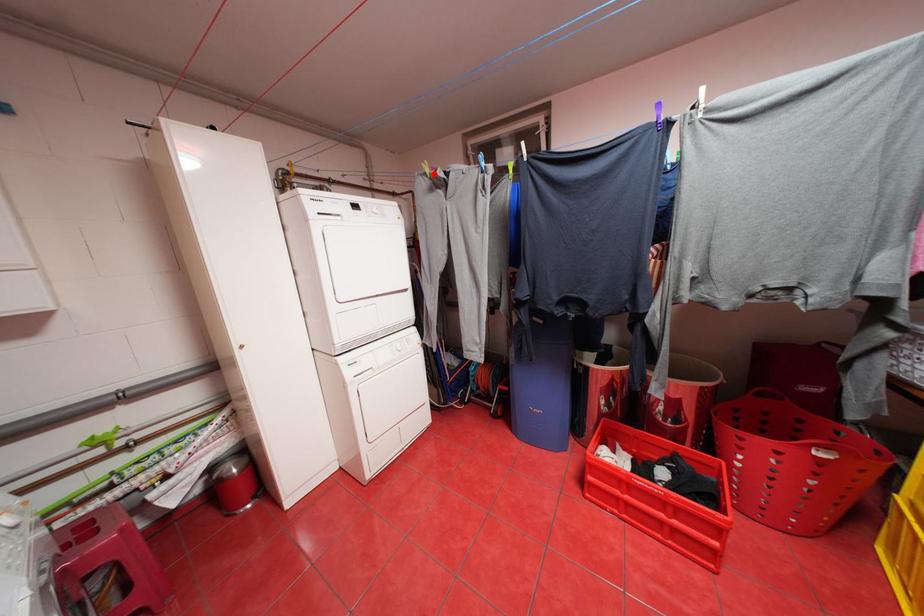
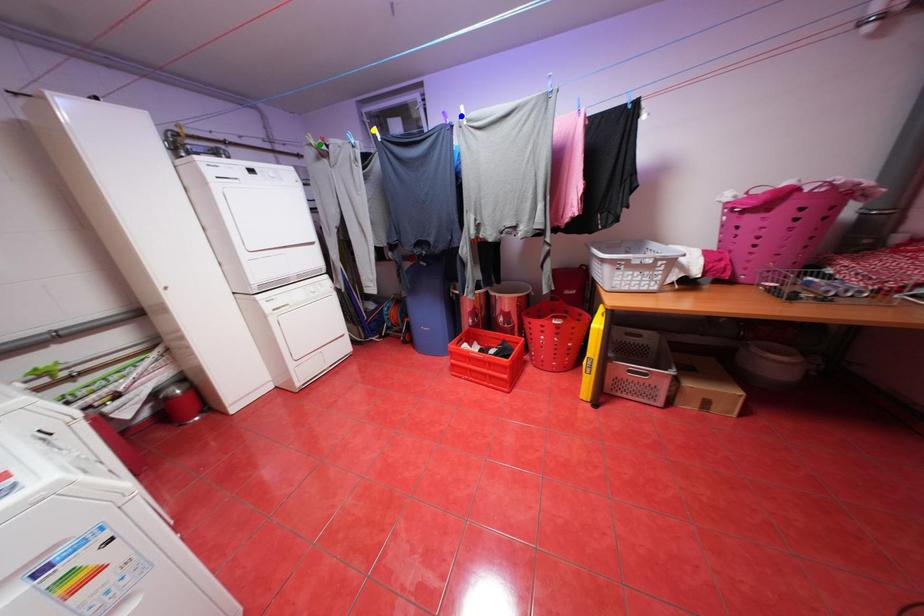
Question: I am providing you with two images of the same scene from different viewpoints. A red point is marked on the first image. You are given multiple points on the second image. Can you choose the point in image 2 that corresponds to the point in image 1?

Choices:
 (A) yellow point
 (B) green point
 (C) blue point

Answer: (B)